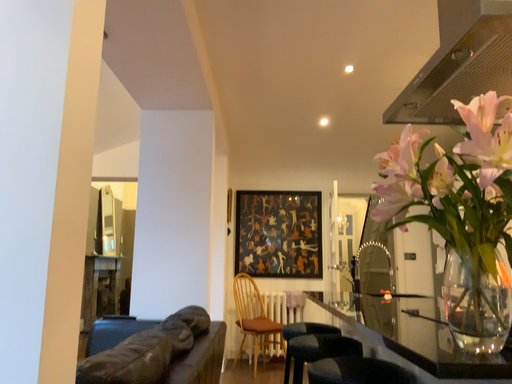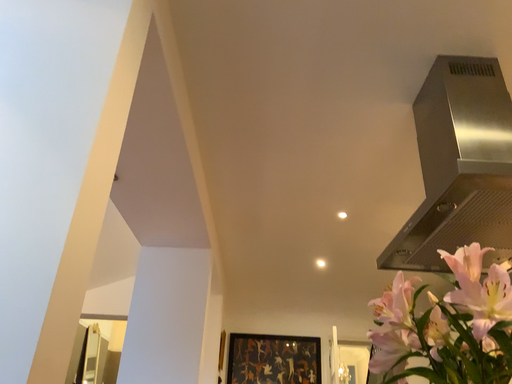
Question: Which way did the camera rotate in the video?

Choices:
 (A) rotated upward
 (B) rotated downward

Answer: (A)